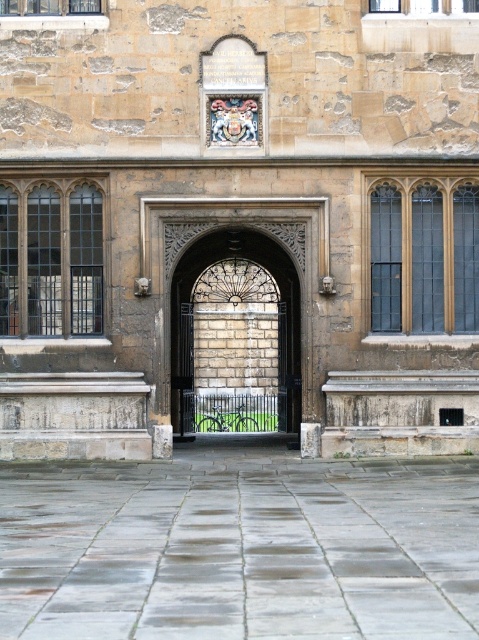
Question: Which object appears farthest from the camera in this image?

Choices:
 (A) dark brown wooden window at left
 (B) matte glass window at right

Answer: (B)

Question: Which point appears closest to the camera in this image?

Choices:
 (A) (57, 332)
 (B) (53, 4)
 (C) (203, 349)
 (D) (468, 234)

Answer: (A)

Question: Does dark brown stone gate at center have a smaller size compared to clear glass window at upper center?

Choices:
 (A) yes
 (B) no

Answer: (A)

Question: Is matte glass window at right below clear glass window at upper left?

Choices:
 (A) no
 (B) yes

Answer: (B)

Question: Which object is positioned farthest from the dark brown stone gate at center?

Choices:
 (A) dark brown wooden window at left
 (B) matte glass window at right
 (C) clear glass window at upper left
 (D) clear glass window at upper center

Answer: (D)

Question: Can you confirm if matte glass window at right is bigger than clear glass window at upper left?

Choices:
 (A) no
 (B) yes

Answer: (B)